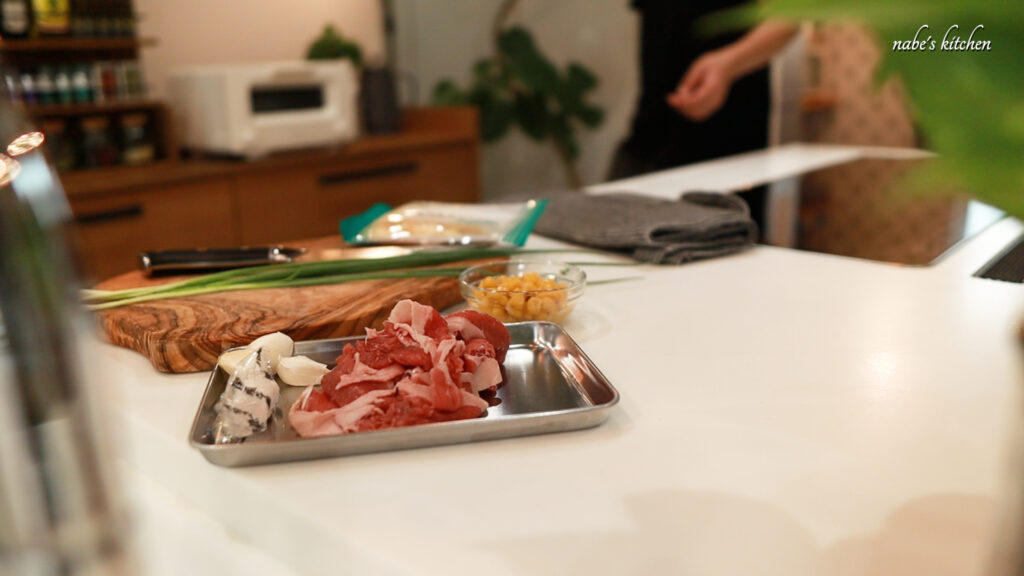
Identify the location of brown towel. (701, 227).